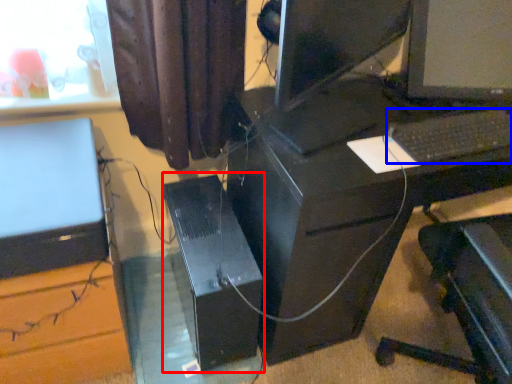
Question: Among these objects, which one is nearest to the camera, computer tower (highlighted by a red box) or computer keyboard (highlighted by a blue box)?

Choices:
 (A) computer tower
 (B) computer keyboard

Answer: (B)